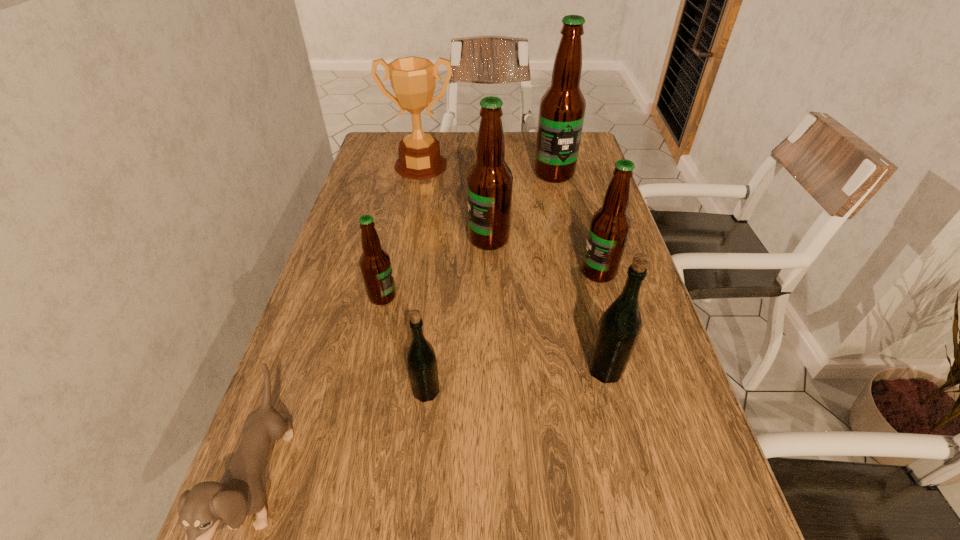
This screenshot has width=960, height=540. Find the location of `free location at the left edge of the desktop`. free location at the left edge of the desktop is located at coordinates (340, 222).

Locate an element on the screen. The width and height of the screenshot is (960, 540). vacant position at the right edge of the desktop is located at coordinates (636, 377).

At what (x,y) coordinates should I click in order to perform the action: click on vacant space at the far right corner. Please return your answer as a coordinate pair (x, y). The width and height of the screenshot is (960, 540). Looking at the image, I should click on (588, 138).

Locate an element on the screen. This screenshot has height=540, width=960. empty location between the award and the right green beer bottle is located at coordinates (514, 268).

Find the location of a particular element. The height and width of the screenshot is (540, 960). blank region between the award and the fifth beer bottle from right to left is located at coordinates (423, 279).

Locate an element on the screen. The width and height of the screenshot is (960, 540). free space between the farthest brown beer bottle and the fourth farthest object is located at coordinates (576, 223).

Identify the location of unoccupied area between the fourth nearest object and the award. (401, 231).

At what (x,y) coordinates should I click in order to perform the action: click on vacant space that is in between the farthest beer bottle and the third farthest brown beer bottle. Please return your answer as a coordinate pair (x, y). This screenshot has height=540, width=960. Looking at the image, I should click on (576, 223).

At what (x,y) coordinates should I click in order to perform the action: click on free spot between the fifth nearest beer bottle and the biggest brown beer bottle. Please return your answer as a coordinate pair (x, y). This screenshot has height=540, width=960. Looking at the image, I should click on (521, 206).

You are a GUI agent. You are given a task and a screenshot of the screen. Output one action in this format:
    pyautogui.click(x=<x>, y=<y>)
    Task: Click on the empty space between the left green beer bottle and the award
    
    Given the screenshot: What is the action you would take?
    pyautogui.click(x=423, y=279)